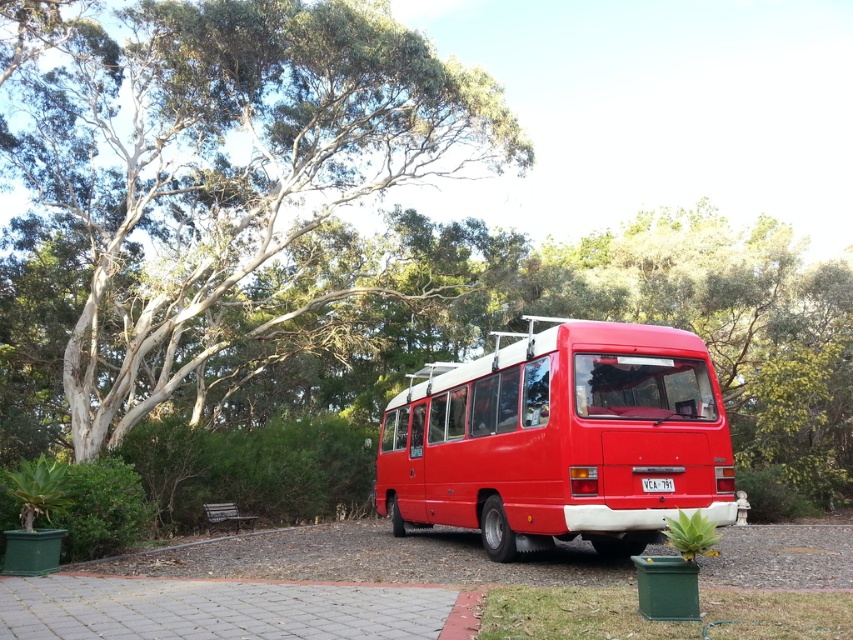
Question: Can you confirm if smooth bark tree at upper left is positioned above shiny red bus at center?

Choices:
 (A) yes
 (B) no

Answer: (A)

Question: Which of the following is the farthest from the observer?

Choices:
 (A) shiny red bus at center
 (B) smooth bark tree at upper left

Answer: (B)

Question: From the image, what is the correct spatial relationship of smooth bark tree at upper left in relation to shiny red bus at center?

Choices:
 (A) above
 (B) below

Answer: (A)

Question: Does smooth bark tree at upper left appear over shiny red bus at center?

Choices:
 (A) no
 (B) yes

Answer: (B)